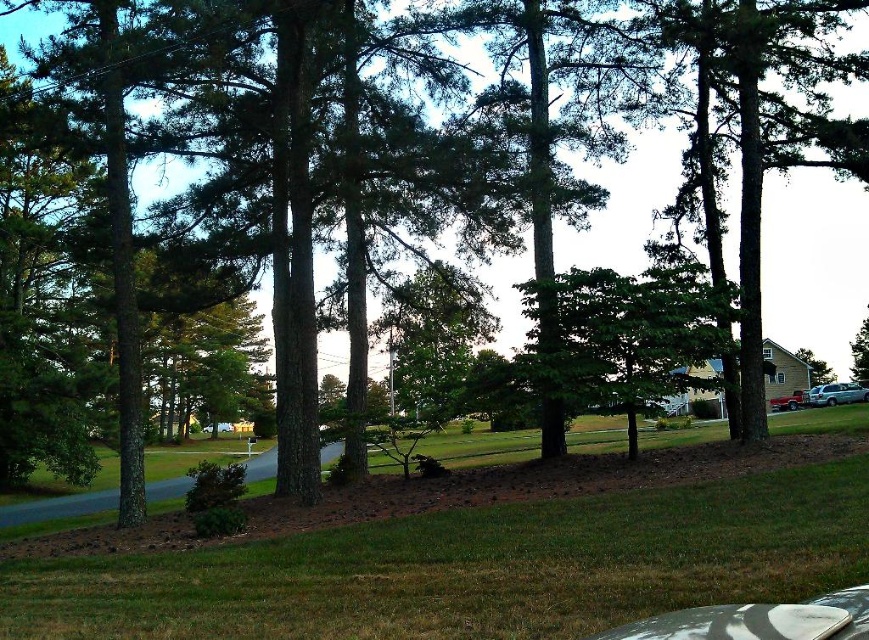
Is green grass at lower center smaller than green leafy tree at right?

Incorrect, green grass at lower center is not smaller in size than green leafy tree at right.

Is the position of green grass at lower center less distant than that of green leafy tree at right?

Yes, green grass at lower center is closer to the viewer.

The height and width of the screenshot is (640, 869). What do you see at coordinates (471, 566) in the screenshot?
I see `green grass at lower center` at bounding box center [471, 566].

Locate an element on the screen. The width and height of the screenshot is (869, 640). green grass at lower center is located at coordinates (471, 566).

Which is behind, point (848, 392) or point (854, 362)?

The point (854, 362) is more distant.

Is satin silver suv at lower right to the right of green leafy tree at right from the viewer's perspective?

Incorrect, satin silver suv at lower right is not on the right side of green leafy tree at right.

Is point (826, 401) positioned after point (854, 337)?

No.

Locate an element on the screen. satin silver suv at lower right is located at coordinates (837, 394).

Is point (272, 545) positioned before point (861, 390)?

Yes, it is in front of point (861, 390).

The width and height of the screenshot is (869, 640). I want to click on green grass at lower center, so click(471, 566).